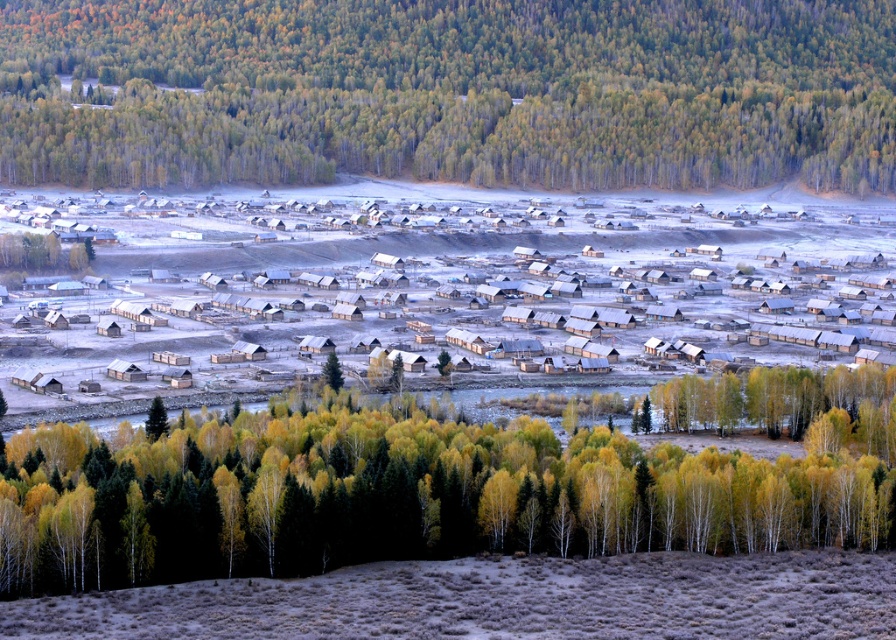
Question: Does yellow-green leaves at center appear on the left side of dry grassland at lower center?

Choices:
 (A) no
 (B) yes

Answer: (B)

Question: Is green matte forest at upper center positioned before white wooden houses at center?

Choices:
 (A) no
 (B) yes

Answer: (A)

Question: Among these objects, which one is nearest to the camera?

Choices:
 (A) dry grassland at lower center
 (B) white wooden houses at center

Answer: (A)

Question: Among these points, which one is farthest from the camera?

Choices:
 (A) (846, 589)
 (B) (432, 340)
 (C) (188, 563)
 (D) (635, 17)

Answer: (D)

Question: Is green matte forest at upper center positioned before yellow-green leaves at center?

Choices:
 (A) no
 (B) yes

Answer: (A)

Question: Among these points, which one is farthest from the camera?

Choices:
 (A) (125, 113)
 (B) (421, 369)

Answer: (A)